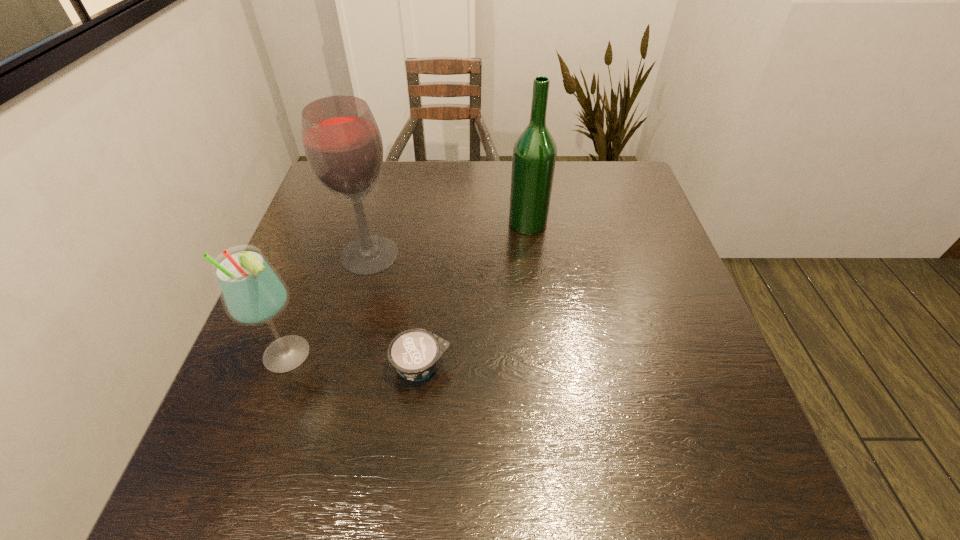
Identify the location of vacant point at the left edge. The image size is (960, 540). (347, 233).

In the image, there is a desktop. Identify the location of vacant space at the right edge. (636, 234).

The height and width of the screenshot is (540, 960). I want to click on vacant space at the far left corner of the desktop, so click(328, 191).

In the image, there is a desktop. Where is `vacant space at the far right corner`? This screenshot has width=960, height=540. vacant space at the far right corner is located at coordinates (605, 185).

The image size is (960, 540). Find the location of `vacant space that's between the shortest alcohol and the second object from right to left`. vacant space that's between the shortest alcohol and the second object from right to left is located at coordinates (355, 361).

You are a GUI agent. You are given a task and a screenshot of the screen. Output one action in this format:
    pyautogui.click(x=<x>, y=<y>)
    Task: Click on the empty space that is in between the shortest object and the rightmost alcohol
    
    Given the screenshot: What is the action you would take?
    pyautogui.click(x=474, y=295)

Identify the location of free area in between the shortest alcohol and the rightmost object. (408, 289).

The width and height of the screenshot is (960, 540). Find the location of `free space between the nearest alcohol and the third object from left to right`. free space between the nearest alcohol and the third object from left to right is located at coordinates (355, 361).

Locate an element on the screen. The height and width of the screenshot is (540, 960). vacant area between the second object from right to left and the shortest alcohol is located at coordinates (355, 361).

At what (x,y) coordinates should I click in order to perform the action: click on free space between the yogurt and the rightmost object. Please return your answer as a coordinate pair (x, y). Looking at the image, I should click on (474, 295).